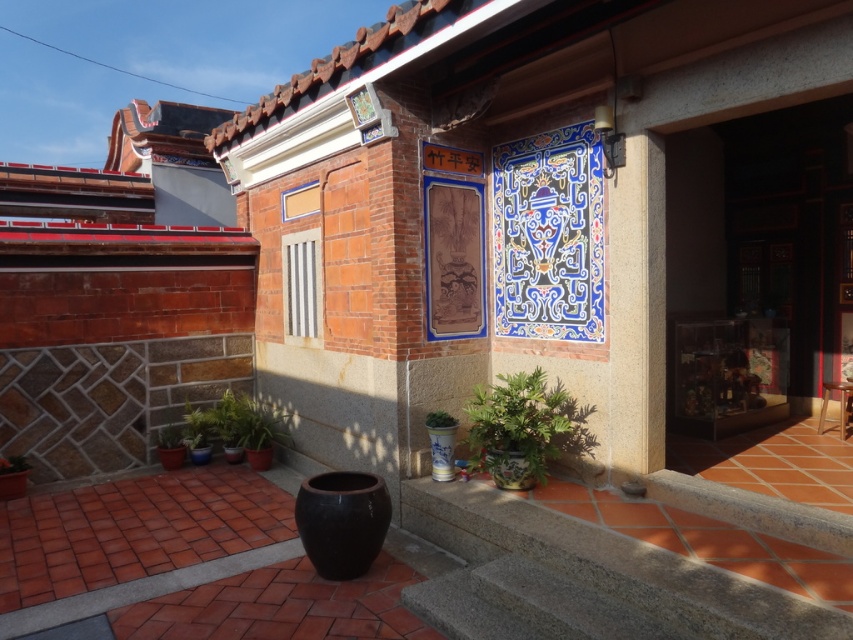
Question: Does green glossy plant at lower center appear under green glossy plant at lower left?

Choices:
 (A) yes
 (B) no

Answer: (B)

Question: Does green glossy plant at lower center appear under green glossy plant at lower left?

Choices:
 (A) no
 (B) yes

Answer: (A)

Question: Is wooden door at center smaller than green glossy plant at lower left?

Choices:
 (A) yes
 (B) no

Answer: (B)

Question: Which point is closer to the camera?

Choices:
 (A) (679, 413)
 (B) (222, 426)
 (C) (476, 388)

Answer: (C)

Question: Which of these objects is positioned closest to the green glossy plant at lower left?

Choices:
 (A) green glossy plant at lower center
 (B) wooden door at center

Answer: (A)

Question: Among these objects, which one is farthest from the camera?

Choices:
 (A) wooden door at center
 (B) green glossy plant at lower center
 (C) green glossy plant at lower left

Answer: (C)